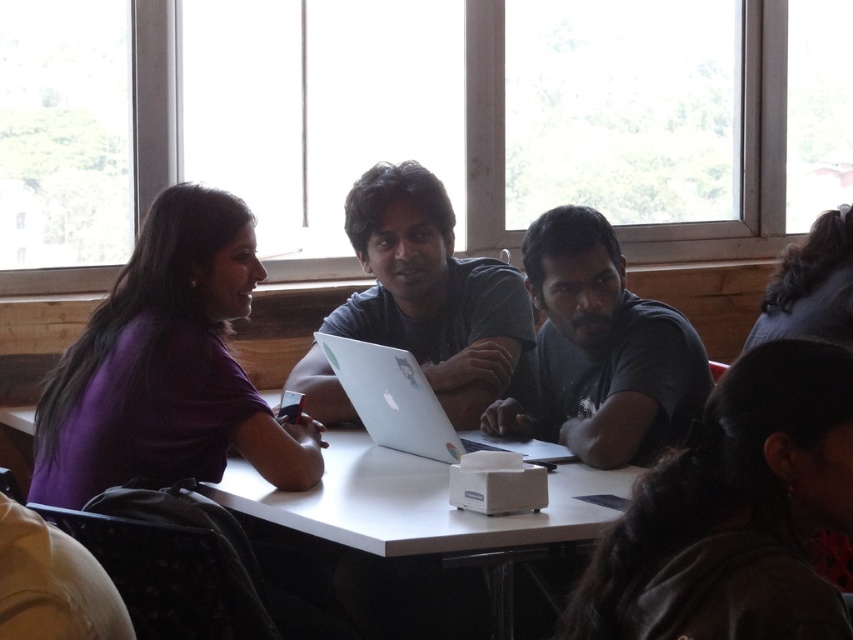
Can you confirm if purple matte shirt at left is positioned to the right of silver metallic laptop at center?

No, purple matte shirt at left is not to the right of silver metallic laptop at center.

At what (x,y) coordinates should I click in order to perform the action: click on purple matte shirt at left. Please return your answer as a coordinate pair (x, y). The height and width of the screenshot is (640, 853). Looking at the image, I should click on (166, 368).

Is point (129, 467) more distant than point (462, 444)?

No, it is in front of (462, 444).

The width and height of the screenshot is (853, 640). What are the coordinates of `purple matte shirt at left` in the screenshot? It's located at (166, 368).

Who is more forward, [403,216] or [444,460]?

Point [444,460] is in front.

Is satin gray laptop at center smaller than silver metallic laptop at center?

No.

Find the location of `satin gray laptop at center`. satin gray laptop at center is located at coordinates [434, 294].

Which is more to the left, gray matte shirt at center or silver metallic laptop at center?

From the viewer's perspective, silver metallic laptop at center appears more on the left side.

Is point (538, 257) positioned behind point (396, 403)?

Yes, it is.

The image size is (853, 640). Find the location of `gray matte shirt at center`. gray matte shirt at center is located at coordinates (601, 349).